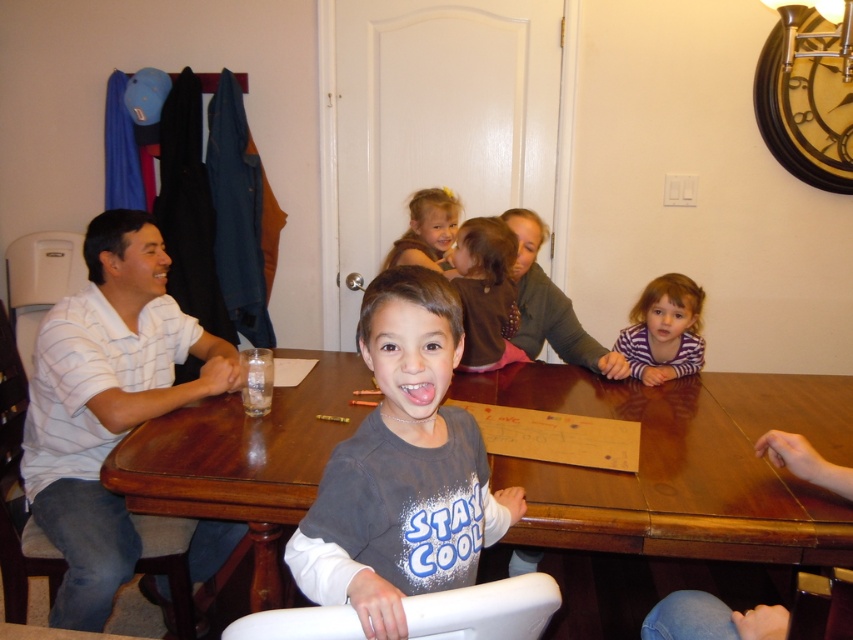
You are a photographer taking a picture of the purple striped shirt at lower right and the smooth brown hair at upper center. Which object should you focus on first if you want to capture both in the same frame without moving the camera?

The purple striped shirt at lower right is smaller in size compared to the smooth brown hair at upper center, so you should focus on the smaller object first to ensure both fit in the frame properly.

You are standing at the camera position and want to toss a small ball to the purple striped shirt at lower right. The ball has a range of 2 meters. Will it reach?

The distance between the purple striped shirt at lower right and the camera is 2.13 meters, which is beyond the ball range of 2 meters. So the ball won not reach.